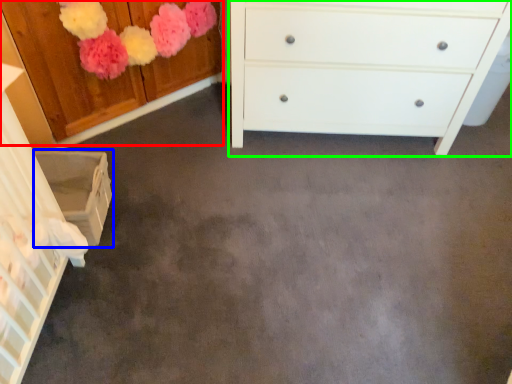
Question: Which object is positioned farthest from cabinetry (highlighted by a red box)? Select from cabinetry (highlighted by a blue box) and chest of drawers (highlighted by a green box).

Choices:
 (A) cabinetry
 (B) chest of drawers

Answer: (B)